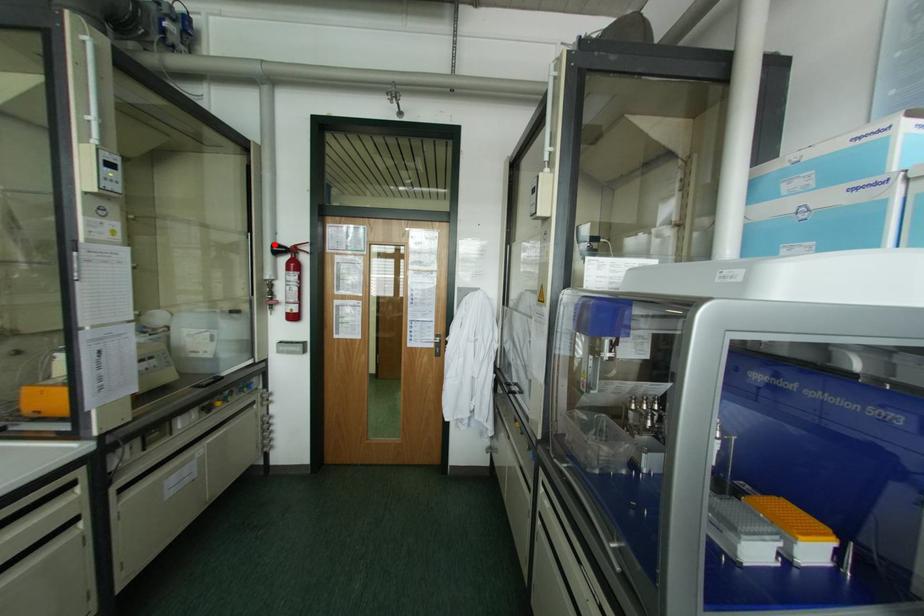
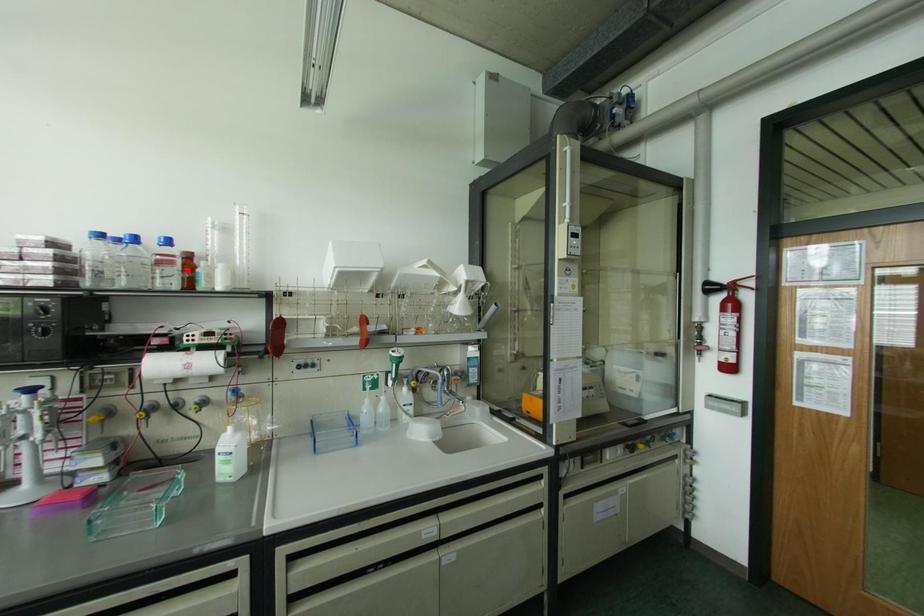
I am providing you with two images of the same scene from different viewpoints. A red point is marked on the first image and another point is marked on the second image. Is the marked point in image1 the same physical position as the marked point in image2?

No